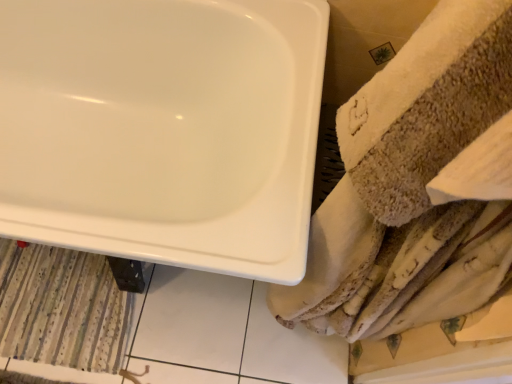
Question: Is point (70, 168) positioned closer to the camera than point (117, 312)?

Choices:
 (A) farther
 (B) closer

Answer: (B)

Question: From the image's perspective, is white glossy bathtub at upper left located above or below striped fabric bath mat at lower left?

Choices:
 (A) below
 (B) above

Answer: (B)

Question: Is white glossy bathtub at upper left bigger or smaller than striped fabric bath mat at lower left?

Choices:
 (A) small
 (B) big

Answer: (B)

Question: In terms of width, does striped fabric bath mat at lower left look wider or thinner when compared to white glossy bathtub at upper left?

Choices:
 (A) thin
 (B) wide

Answer: (A)

Question: Is striped fabric bath mat at lower left in front of or behind white glossy bathtub at upper left in the image?

Choices:
 (A) front
 (B) behind

Answer: (B)

Question: Is striped fabric bath mat at lower left taller or shorter than white glossy bathtub at upper left?

Choices:
 (A) short
 (B) tall

Answer: (A)

Question: Considering the positions of striped fabric bath mat at lower left and white glossy bathtub at upper left in the image, is striped fabric bath mat at lower left bigger or smaller than white glossy bathtub at upper left?

Choices:
 (A) big
 (B) small

Answer: (B)